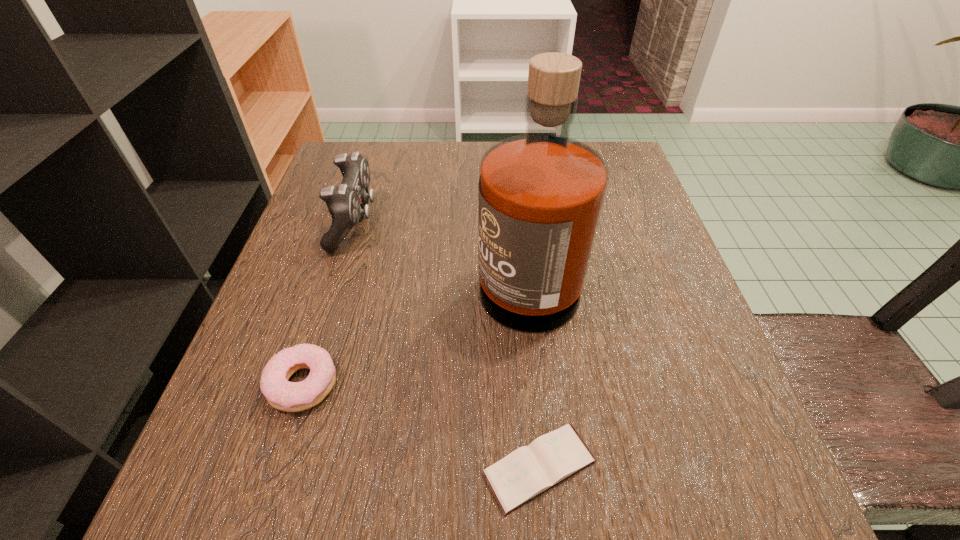
Find the location of `free space at the right edge`. free space at the right edge is located at coordinates (645, 309).

Locate an element on the screen. This screenshot has width=960, height=540. free space at the far left corner is located at coordinates (377, 153).

Where is `empty space that is in between the second nearest object and the control`? This screenshot has height=540, width=960. empty space that is in between the second nearest object and the control is located at coordinates (328, 303).

Find the location of a particular element. free space between the control and the third tallest object is located at coordinates (328, 303).

Where is `vacant space in between the third farthest object and the tallest object`? This screenshot has width=960, height=540. vacant space in between the third farthest object and the tallest object is located at coordinates (415, 326).

Find the location of `empty space that is in between the diary and the control`. empty space that is in between the diary and the control is located at coordinates (447, 345).

You are a GUI agent. You are given a task and a screenshot of the screen. Output one action in this format:
    pyautogui.click(x=<x>, y=<y>)
    Task: Click on the free spot between the diary and the liquor
    The width and height of the screenshot is (960, 540).
    Given the screenshot: What is the action you would take?
    pyautogui.click(x=533, y=367)

Find the location of a particular element. The width and height of the screenshot is (960, 540). vacant point located between the tallest object and the control is located at coordinates (441, 245).

The height and width of the screenshot is (540, 960). Identify the location of blank region between the second nearest object and the shortest object. (420, 426).

In order to click on unoccupied area between the shortest object and the third tallest object in this screenshot , I will do `click(420, 426)`.